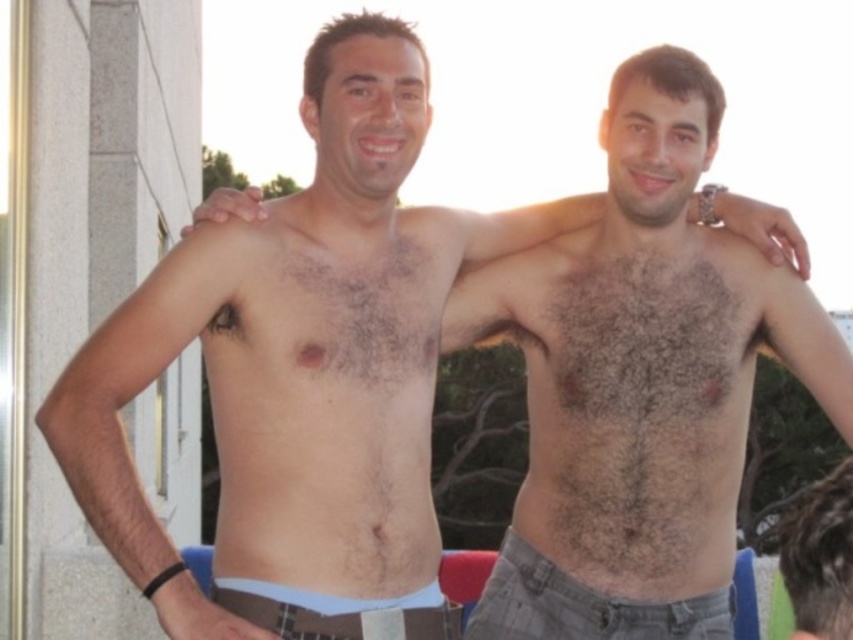
Question: Does white concrete pillar at left have a lesser width compared to white fabric shorts at lower center?

Choices:
 (A) yes
 (B) no

Answer: (B)

Question: Which object is positioned closest to the brown hair at upper right?

Choices:
 (A) brown hairy chest at center
 (B) dark brown hairy chest at center
 (C) white fabric shorts at lower center
 (D) gray fabric shorts at lower center

Answer: (B)

Question: Observing the image, what is the correct spatial positioning of dark brown hairy chest at center in reference to white fabric shorts at lower center?

Choices:
 (A) below
 (B) above

Answer: (B)

Question: Which of the following is the closest to the observer?

Choices:
 (A) (384, 620)
 (B) (724, 364)

Answer: (A)

Question: Can you confirm if dark brown hairy chest at center is thinner than brown hairy chest at center?

Choices:
 (A) no
 (B) yes

Answer: (A)

Question: Based on their relative distances, which object is farther from the white concrete pillar at left?

Choices:
 (A) white fabric shorts at lower center
 (B) gray fabric shorts at lower center
 (C) brown hair at upper right

Answer: (C)